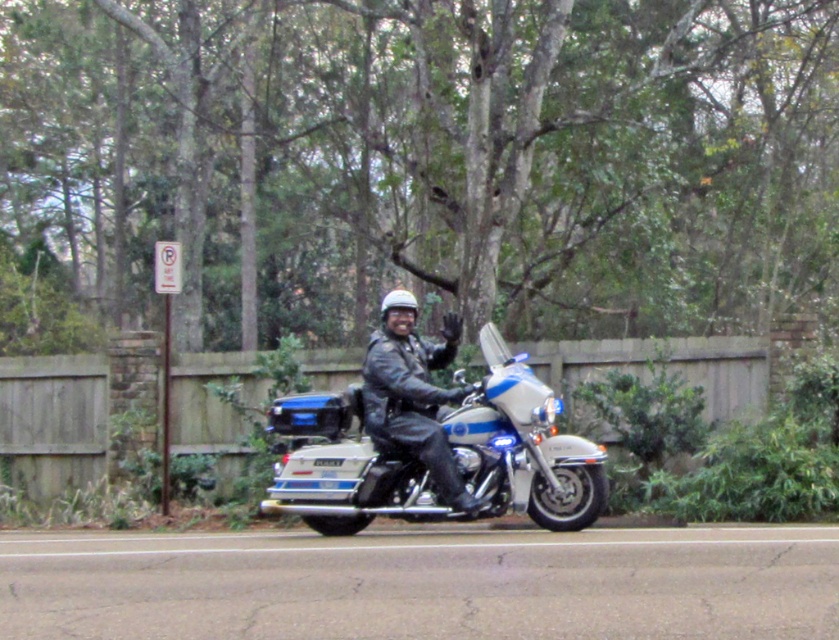
Question: Which point appears closest to the camera in this image?

Choices:
 (A) (504, 433)
 (B) (392, 328)

Answer: (A)

Question: Where is shiny chrome motorcycle at center located in relation to matte black leather jacket at center in the image?

Choices:
 (A) below
 (B) above

Answer: (A)

Question: Is green leafy tree at center to the left of matte black leather jacket at center from the viewer's perspective?

Choices:
 (A) yes
 (B) no

Answer: (A)

Question: Which of the following is the closest to the observer?

Choices:
 (A) shiny chrome motorcycle at center
 (B) matte black leather jacket at center

Answer: (B)

Question: Can you confirm if green leafy tree at center is positioned to the right of shiny chrome motorcycle at center?

Choices:
 (A) no
 (B) yes

Answer: (A)

Question: Which point is farther from the camera taking this photo?

Choices:
 (A) (306, 163)
 (B) (384, 392)

Answer: (A)